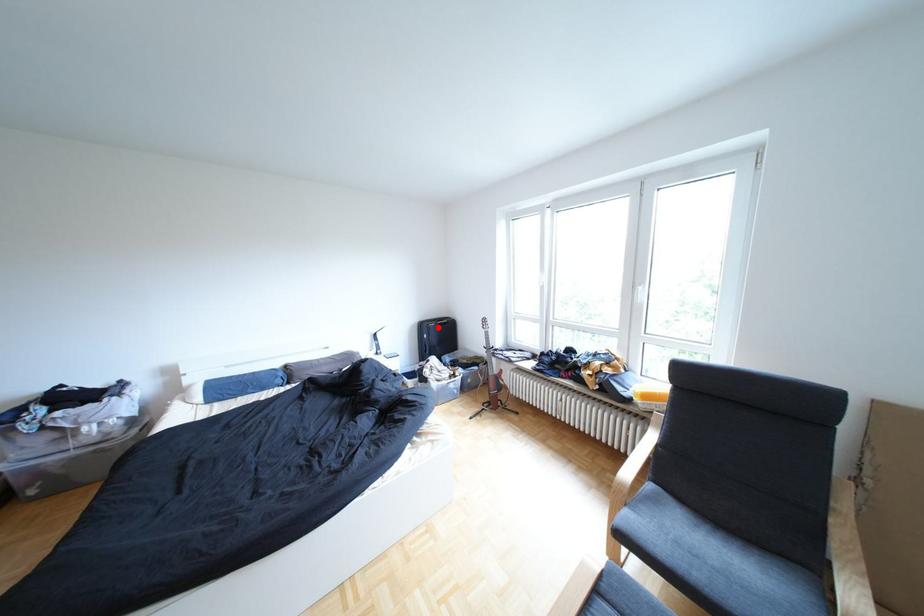
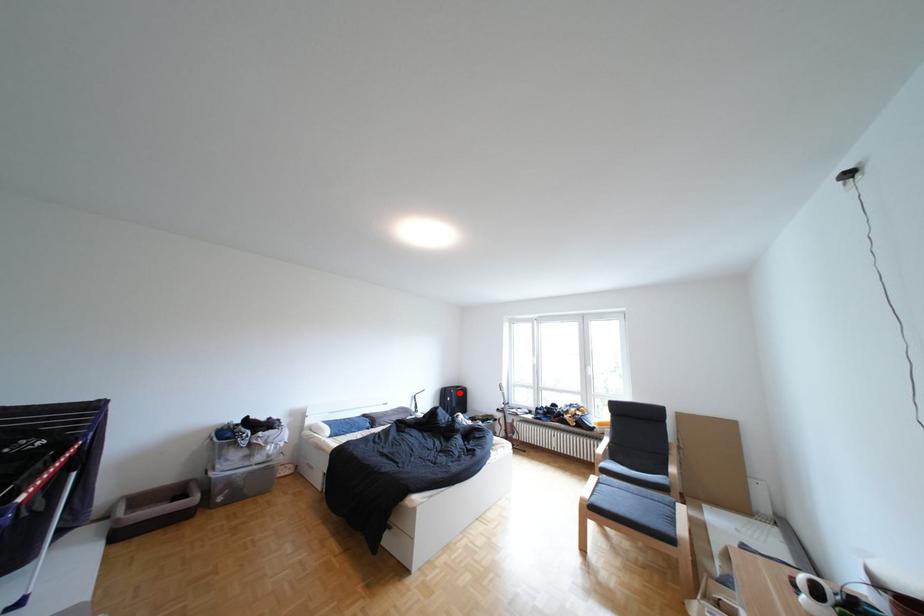
I am providing you with two images of the same scene from different viewpoints. A red point is marked on the first image and another point is marked on the second image. Is the marked point in image1 the same physical position as the marked point in image2?

Yes